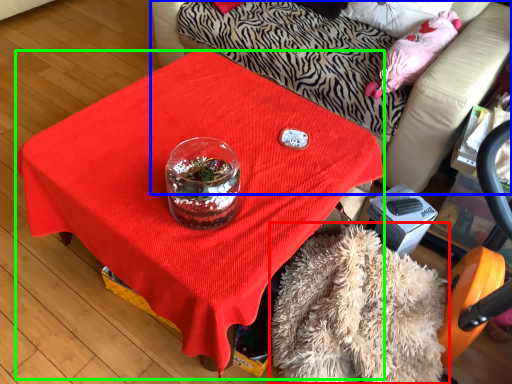
Question: Which object is positioned farthest from blanket (highlighted by a red box)? Select from furniture (highlighted by a blue box) and desk (highlighted by a green box).

Choices:
 (A) furniture
 (B) desk

Answer: (A)